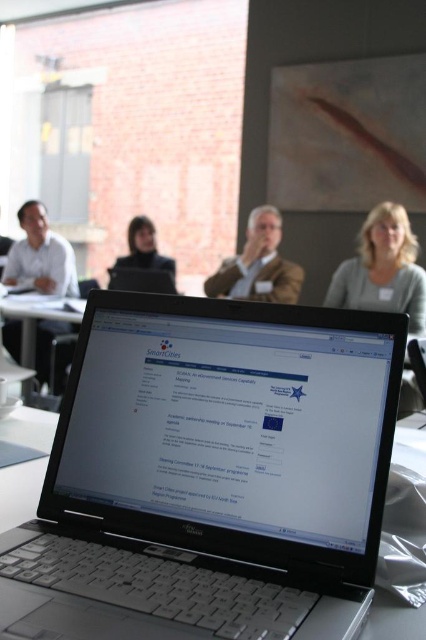
Question: Which object is the farthest from the matte black laptop at center?

Choices:
 (A) light gray sweater at upper right
 (B) brown textured suit at center

Answer: (A)

Question: Which point is farther to the camera?

Choices:
 (A) (393, 218)
 (B) (32, 243)

Answer: (B)

Question: Estimate the real-world distances between objects in this image. Which object is closer to the white plastic table at center?

Choices:
 (A) matte white shirt at left
 (B) black plastic laptop at center

Answer: (A)

Question: Can you confirm if light gray sweater at upper right is wider than matte white shirt at left?

Choices:
 (A) yes
 (B) no

Answer: (B)

Question: Does matte white shirt at left have a lesser width compared to white plastic table at center?

Choices:
 (A) yes
 (B) no

Answer: (A)

Question: Does black plastic laptop at center have a greater width compared to brown textured suit at center?

Choices:
 (A) no
 (B) yes

Answer: (A)